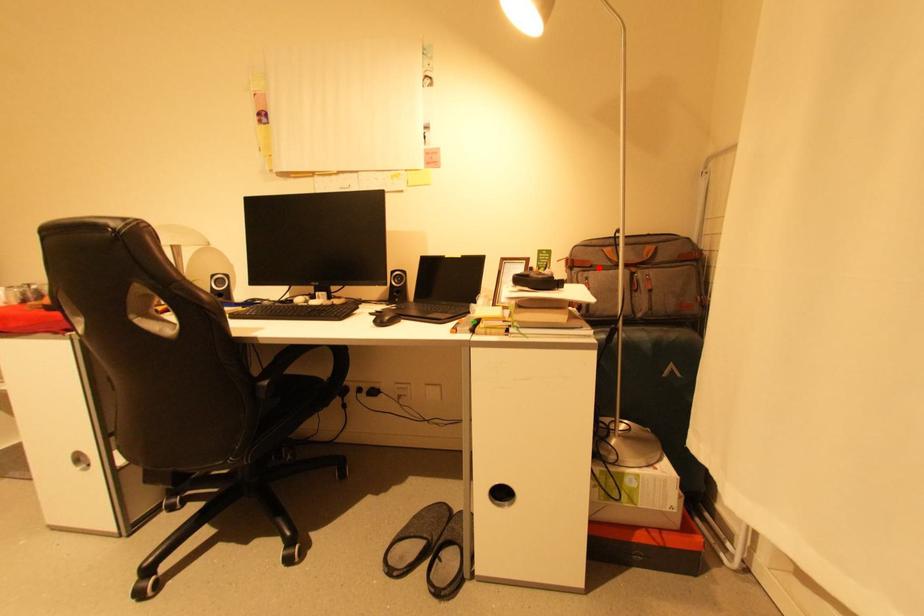
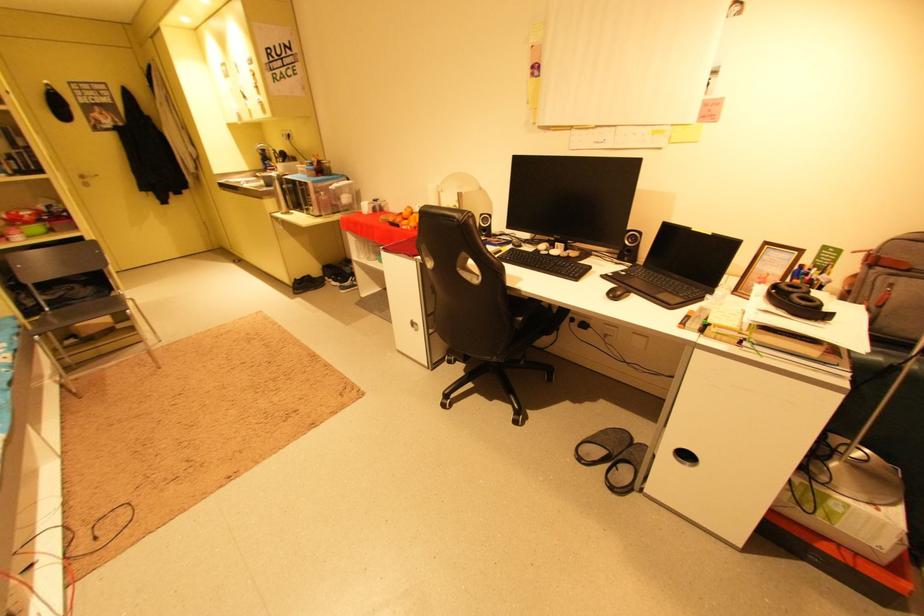
Locate, in the second image, the point that corresponds to the highlighted location in the first image.

(917, 272)